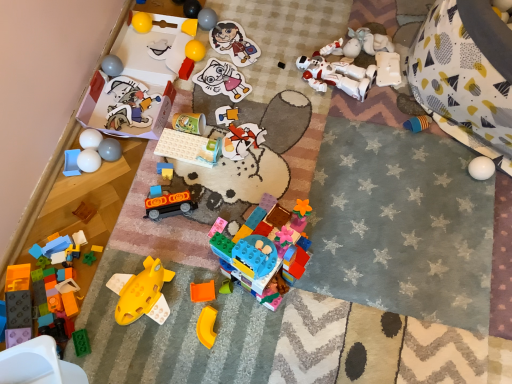
In order to click on free space that is in between yellow matte block at center, which appears as the 13th toy when viewed from the right, and translucent orange plastic at center, arranged as the nineteenth toy when viewed from the left in this screenshot , I will do `click(202, 137)`.